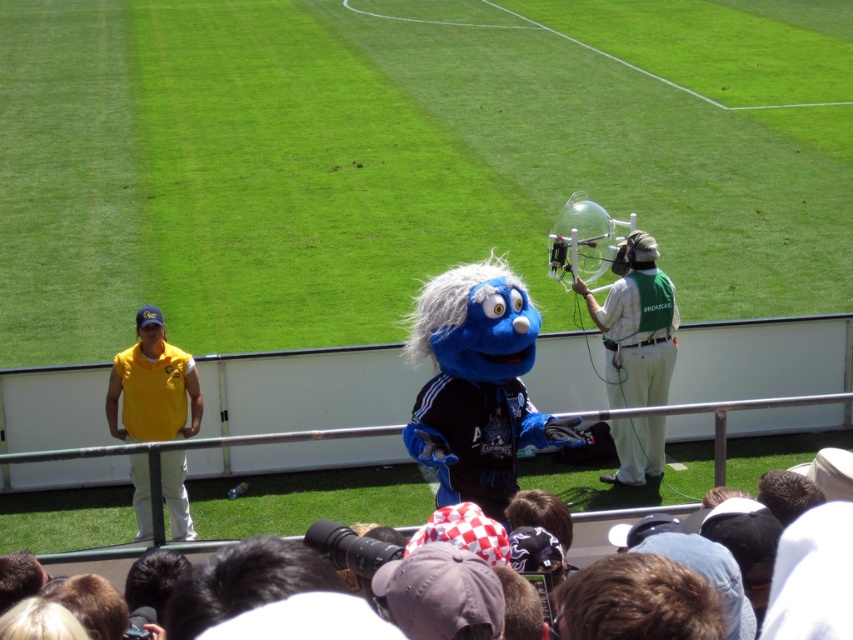
You are a photographer at the stadium and need to capture a photo that includes both the green fabric microphone at right and the yellow fabric shirt at left. Since you want the microphone to be the main focus, which object should you position closer to the camera to ensure it appears larger in the photo?

To make the green fabric microphone at right appear larger in the photo, you should position it closer to the camera since it is already taller than the yellow fabric shirt at left.

You are a stagehand at the stadium and need to place a new microphone stand. The stand can only hold objects up to the size of the yellow fabric shirt at left. Will the green fabric microphone at right fit on the stand?

The green fabric microphone at right is larger in size than the yellow fabric shirt at left, so it will not fit on the stand designed for the yellow fabric shirt at left.